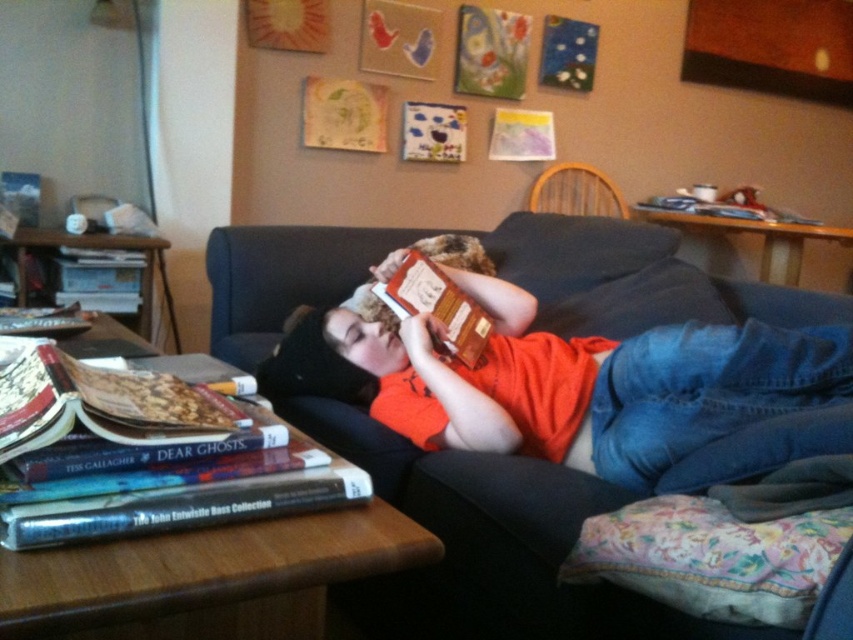
You are standing in the living room and want to place a new book on the coffee table. The coffee table has a coordinate system where the bottom left corner is the origin. The existing book is at point (149, 456). If you want to place the new book to the right of the existing one, what should be the x coordinate of the new book?

The existing hardcover book at lower left is at point (149, 456). To place the new book to the right, the x coordinate should be greater than 0.714, so the new x coordinate could be 0.8.

Looking at this image, you are a delivery robot that needs to place a package on the coffee table between the dark blue fabric couch at center and the hardcover book at lower left. Can you fit the package there if the package is 30 inches long?

The distance between the dark blue fabric couch at center and the hardcover book at lower left is 29.59 inches. Since the package is 30 inches long, it won

You are a photographer trying to capture the scene from above. You notice the hardcover book at lower left and the orange fabric head at center. Which object is closer to the camera?

The orange fabric head at center is closer to the camera because it is positioned above the hardcover book at lower left.